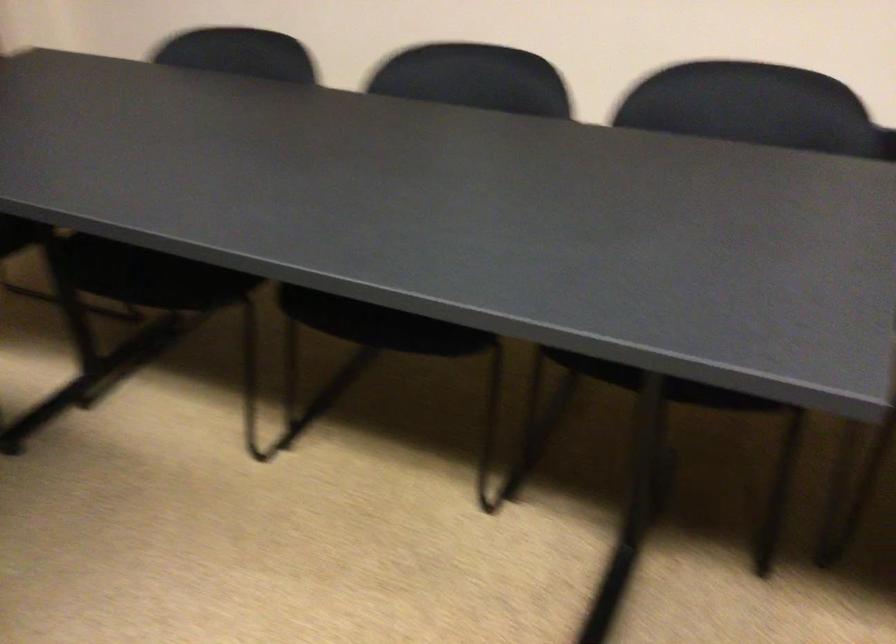
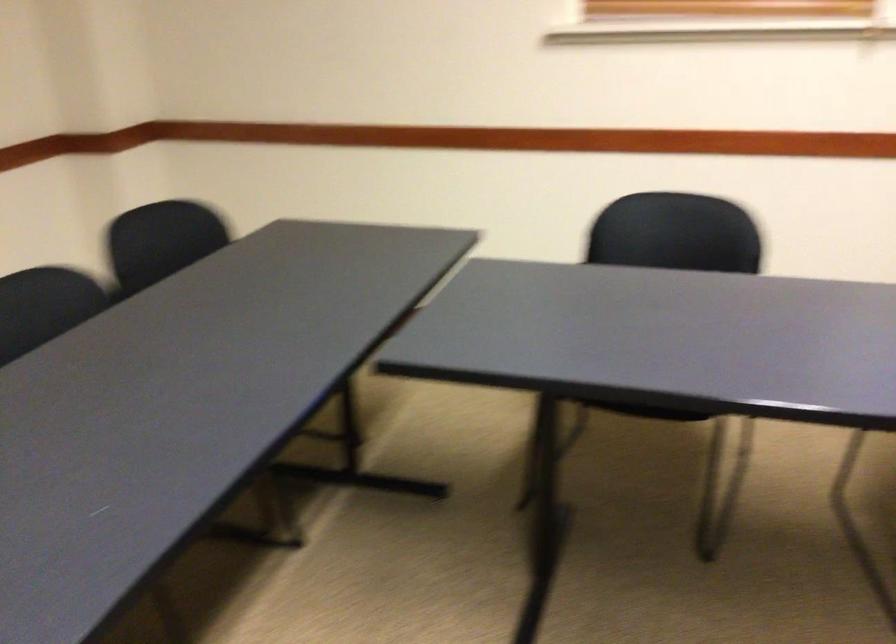
The images are taken continuously from a first-person perspective. In which direction is your viewpoint rotating?

The camera's rotation is toward right-down.